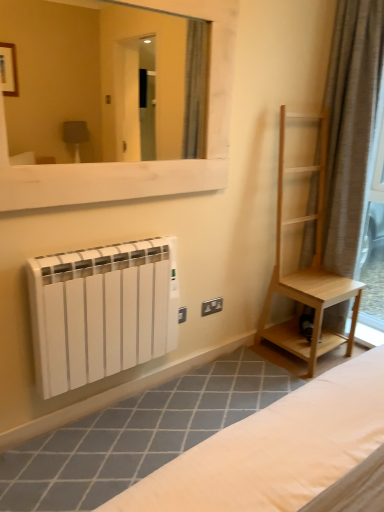
This screenshot has height=512, width=384. Identify the location of vacant region above white matte radiator at lower left (from a real-world perspective). (198, 406).